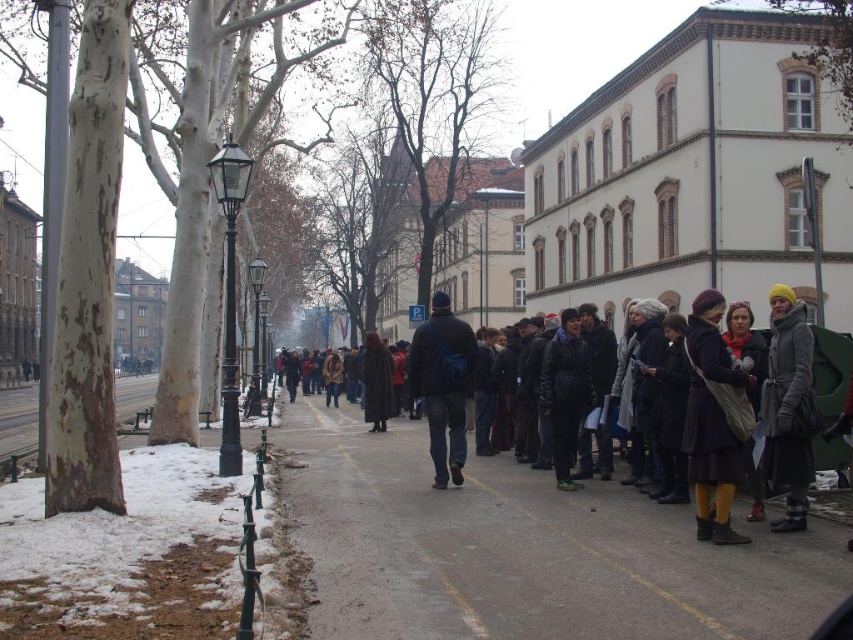
Question: Does dark blue wool coat at center appear on the right side of dark blue fabric jacket at center?

Choices:
 (A) yes
 (B) no

Answer: (A)

Question: Can you confirm if dark blue wool coat at center is positioned to the left of dark blue fabric jacket at center?

Choices:
 (A) no
 (B) yes

Answer: (A)

Question: Among these points, which one is nearest to the camera?

Choices:
 (A) (723, 355)
 (B) (556, 580)
 (C) (790, 531)

Answer: (B)

Question: Is dark blue wool coat at center closer to camera compared to yellow knit hat at right?

Choices:
 (A) yes
 (B) no

Answer: (A)

Question: Which point appears closest to the camera in this image?

Choices:
 (A) (811, 618)
 (B) (793, 468)
 (C) (426, 380)
 (D) (734, 468)

Answer: (A)

Question: Among these objects, which one is nearest to the camera?

Choices:
 (A) dark blue wool coat at center
 (B) dark gray coat at center
 (C) dark blue fabric jacket at center
 (D) gray asphalt sidewalk at center

Answer: (D)